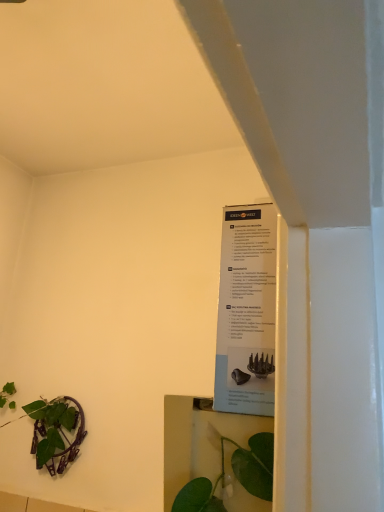
Find the location of `white paper at center`. white paper at center is located at coordinates (246, 311).

What is the approximate width of white paper at center?

white paper at center is 3.60 inches wide.

What do you see at coordinates (246, 311) in the screenshot?
I see `white paper at center` at bounding box center [246, 311].

Image resolution: width=384 pixels, height=512 pixels. I want to click on white paper at center, so click(x=246, y=311).